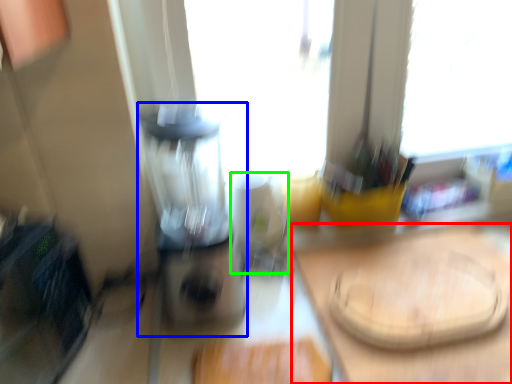
Question: Based on their relative distances, which object is farther from counter top (highlighted by a red box)? Choose from blender (highlighted by a blue box) and appliance (highlighted by a green box).

Choices:
 (A) blender
 (B) appliance

Answer: (A)